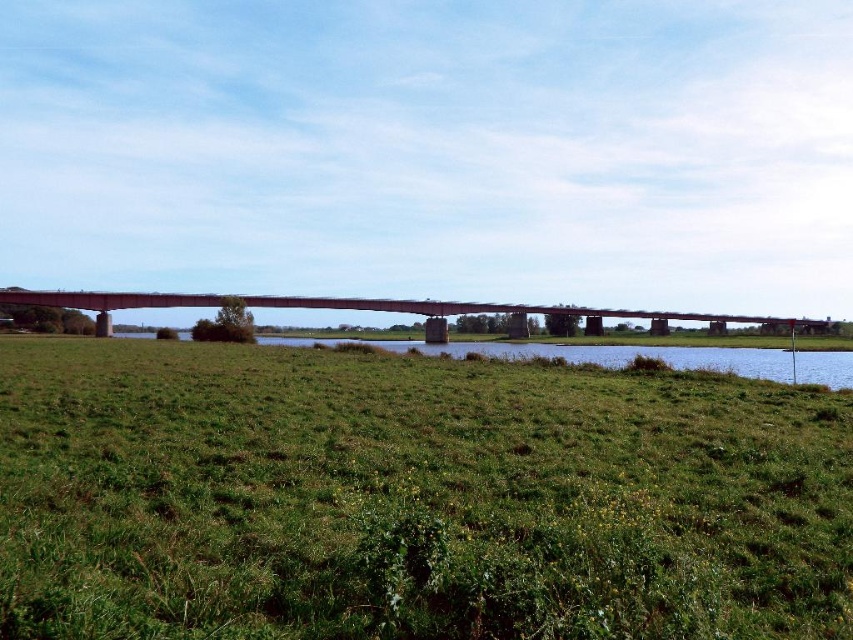
Question: Among these points, which one is nearest to the camera?

Choices:
 (A) (781, 365)
 (B) (703, 621)
 (C) (601, 328)

Answer: (B)

Question: Does green grassy field at center appear over green grassy field at lower center?

Choices:
 (A) no
 (B) yes

Answer: (B)

Question: Among these objects, which one is nearest to the camera?

Choices:
 (A) green grassy field at lower center
 (B) concrete bridge at center

Answer: (A)

Question: Can you confirm if green grassy field at center is bigger than concrete bridge at center?

Choices:
 (A) no
 (B) yes

Answer: (A)

Question: Among these points, which one is farthest from the camera?

Choices:
 (A) (764, 372)
 (B) (164, 292)
 (C) (357, 364)

Answer: (B)

Question: Does green grassy field at center have a greater width compared to concrete bridge at center?

Choices:
 (A) yes
 (B) no

Answer: (B)